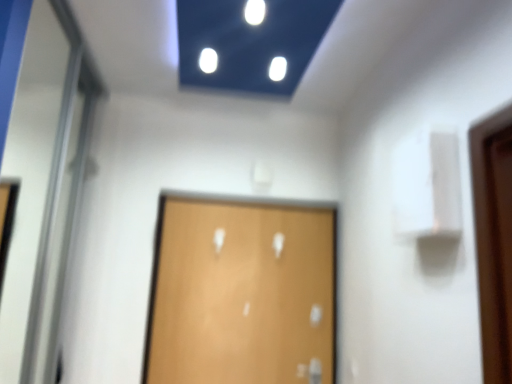
What do you see at coordinates (242, 291) in the screenshot? The height and width of the screenshot is (384, 512). I see `wooden door at center` at bounding box center [242, 291].

You are a GUI agent. You are given a task and a screenshot of the screen. Output one action in this format:
    pyautogui.click(x=<x>, y=<y>)
    Task: Click on the wooden door at center
    The width and height of the screenshot is (512, 384).
    Given the screenshot: What is the action you would take?
    pyautogui.click(x=242, y=291)

This screenshot has height=384, width=512. What do you see at coordinates (40, 180) in the screenshot? I see `white glossy elevator door at left` at bounding box center [40, 180].

Identify the location of white glossy elevator door at left. (40, 180).

The image size is (512, 384). Find the location of `wooden door at center`. wooden door at center is located at coordinates (242, 291).

Which is more to the right, white glossy elevator door at left or wooden door at center?

wooden door at center is more to the right.

Which is in front, white glossy elevator door at left or wooden door at center?

white glossy elevator door at left is more forward.

Which is further, (x=10, y=30) or (x=196, y=381)?

The point (x=196, y=381) is farther.

From the image's perspective, who appears lower, white glossy elevator door at left or wooden door at center?

From the image's view, wooden door at center is below.

From a real-world perspective, who is located lower, white glossy elevator door at left or wooden door at center?

In real-world perspective, wooden door at center is lower.

Is white glossy elevator door at left thinner than wooden door at center?

No.

Considering the sizes of objects white glossy elevator door at left and wooden door at center in the image provided, who is taller, white glossy elevator door at left or wooden door at center?

white glossy elevator door at left is taller.

Who is bigger, white glossy elevator door at left or wooden door at center?

With larger size is white glossy elevator door at left.

Is white glossy elevator door at left inside the boundaries of wooden door at center, or outside?

white glossy elevator door at left is not inside wooden door at center, it's outside.

From the picture: Is white glossy elevator door at left directly adjacent to wooden door at center?

They are not placed beside each other.

Is wooden door at center at the back of white glossy elevator door at left?

white glossy elevator door at left is not turned away from wooden door at center.

How many degrees apart are the facing directions of white glossy elevator door at left and wooden door at center?

The facing directions of white glossy elevator door at left and wooden door at center are 89.6 degrees apart.

Consider the image. Measure the distance between white glossy elevator door at left and wooden door at center.

A distance of 32.51 inches exists between white glossy elevator door at left and wooden door at center.

The height and width of the screenshot is (384, 512). Identify the location of door on the right of white glossy elevator door at left. (242, 291).

Can you confirm if wooden door at center is positioned to the left of white glossy elevator door at left?

No.

Which is behind, wooden door at center or white glossy elevator door at left?

wooden door at center is behind.

Does point (273, 283) appear closer or farther from the camera than point (13, 111)?

Point (273, 283) is positioned closer to the camera compared to point (13, 111).

From the image's perspective, who appears lower, wooden door at center or white glossy elevator door at left?

wooden door at center appears lower in the image.

From a real-world perspective, is wooden door at center under white glossy elevator door at left?

Indeed, from a real-world perspective, wooden door at center is positioned beneath white glossy elevator door at left.

Considering the sizes of objects wooden door at center and white glossy elevator door at left in the image provided, who is wider, wooden door at center or white glossy elevator door at left?

With larger width is white glossy elevator door at left.

Considering the sizes of wooden door at center and white glossy elevator door at left in the image, is wooden door at center taller or shorter than white glossy elevator door at left?

Considering their sizes, wooden door at center has less height than white glossy elevator door at left.

Who is bigger, wooden door at center or white glossy elevator door at left?

white glossy elevator door at left.

Would you say wooden door at center is inside or outside white glossy elevator door at left?

wooden door at center is spatially situated outside white glossy elevator door at left.

In the scene shown: Is wooden door at center placed right next to white glossy elevator door at left?

There is a gap between wooden door at center and white glossy elevator door at left.

Is wooden door at center looking in the opposite direction of white glossy elevator door at left?

No, wooden door at center is not facing away from white glossy elevator door at left.

Locate an element on the screen. door that appears below the white glossy elevator door at left (from the image's perspective) is located at coordinates (242, 291).

Identify the location of elevator door above the wooden door at center (from the image's perspective). This screenshot has width=512, height=384. [40, 180].

Find the location of a particular element. This screenshot has width=512, height=384. door that is behind the white glossy elevator door at left is located at coordinates (242, 291).